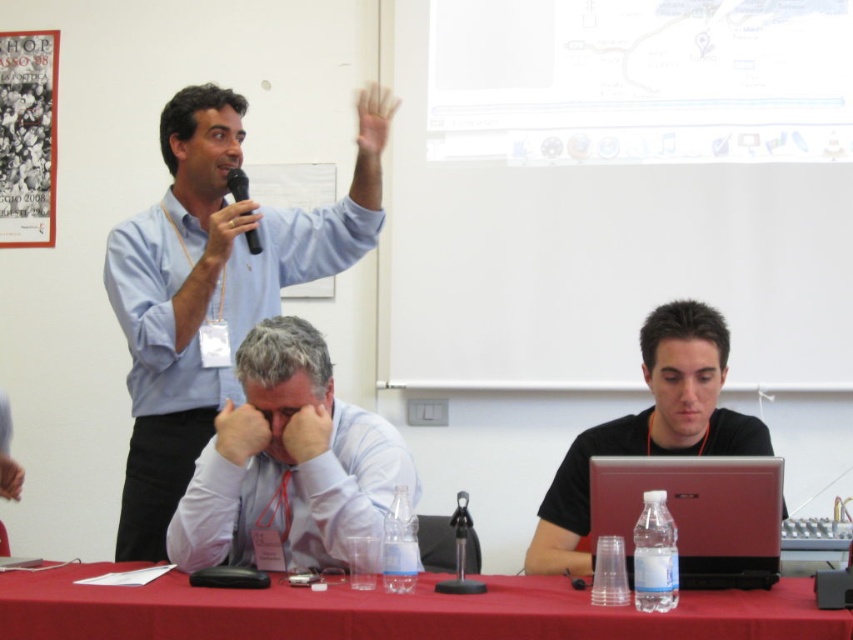
Question: Among these objects, which one is nearest to the camera?

Choices:
 (A) black matte microphone at upper left
 (B) black plastic microphone at upper left
 (C) light blue shirt at upper left
 (D) smooth skin hand at center

Answer: (D)

Question: Based on their relative distances, which object is farther from the matte white hand at center?

Choices:
 (A) red cloth table at lower center
 (B) black matte laptop at lower right

Answer: (B)

Question: Can you confirm if red cloth table at lower center is positioned to the left of white shirt at center?

Choices:
 (A) no
 (B) yes

Answer: (A)

Question: Is satin burgundy laptop at center thinner than black plastic microphone at upper left?

Choices:
 (A) yes
 (B) no

Answer: (B)

Question: Is red cloth table at lower center wider than smooth skin hand at center?

Choices:
 (A) yes
 (B) no

Answer: (A)

Question: Which of the following is the closest to the observer?

Choices:
 (A) black matte microphone at upper left
 (B) smooth skin hand at center

Answer: (B)